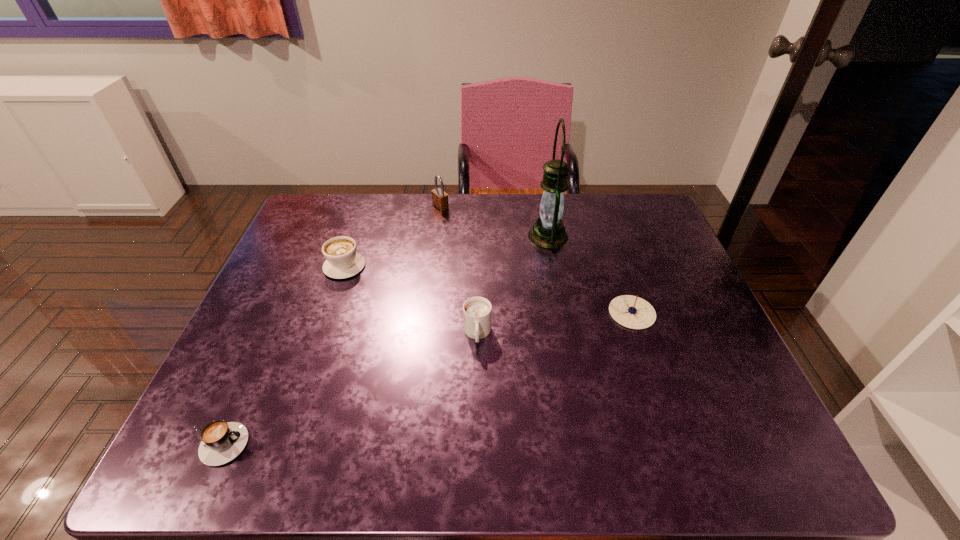
Find the location of a particular element. This screenshot has width=960, height=540. vacant area that lies between the leftmost cappuccino and the rightmost cappuccino is located at coordinates (347, 389).

This screenshot has height=540, width=960. Identify the location of free space that is in between the second tallest object and the tallest object. (494, 221).

This screenshot has height=540, width=960. I want to click on free space that is in between the second cappuccino from left to right and the second nearest cappuccino, so click(x=411, y=300).

You are a GUI agent. You are given a task and a screenshot of the screen. Output one action in this format:
    pyautogui.click(x=<x>, y=<y>)
    Task: Click on the free space between the second shortest object and the second tallest object
    The height and width of the screenshot is (540, 960).
    Given the screenshot: What is the action you would take?
    [x=537, y=260]

You are a GUI agent. You are given a task and a screenshot of the screen. Output one action in this format:
    pyautogui.click(x=<x>, y=<y>)
    Task: Click on the object identified as the third closest to the shortest object
    Image resolution: width=960 pixels, height=540 pixels.
    Given the screenshot: What is the action you would take?
    pyautogui.click(x=439, y=198)

Locate an element on the screen. The height and width of the screenshot is (540, 960). object that stands as the third closest to the third object from right to left is located at coordinates 343,261.

Identify which cappuccino is the third nearest to the compass. Please provide its 2D coordinates. Your answer should be formatted as a tuple, i.e. [(x, y)], where the tuple contains the x and y coordinates of a point satisfying the conditions above.

[(221, 442)]

I want to click on cappuccino object that ranks as the closest to the third object from right to left, so click(343, 261).

Identify the location of vacant space that satisfies the following two spatial constraints: 1. to the right of the fifth shortest object's handle; 2. on the left side of the fifth object from right to left. (365, 207).

You are a GUI agent. You are given a task and a screenshot of the screen. Output one action in this format:
    pyautogui.click(x=<x>, y=<y>)
    Task: Click on the free space that satisfies the following two spatial constraints: 1. on the front side of the second shortest object; 2. with the handle on the side of the nearest object
    
    Given the screenshot: What is the action you would take?
    pyautogui.click(x=677, y=444)